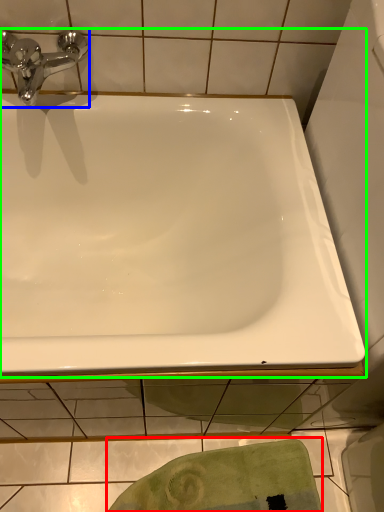
Question: Based on their relative distances, which object is farther from bath towel (highlighted by a red box)? Choose from tap (highlighted by a blue box) and bathtub (highlighted by a green box).

Choices:
 (A) tap
 (B) bathtub

Answer: (A)